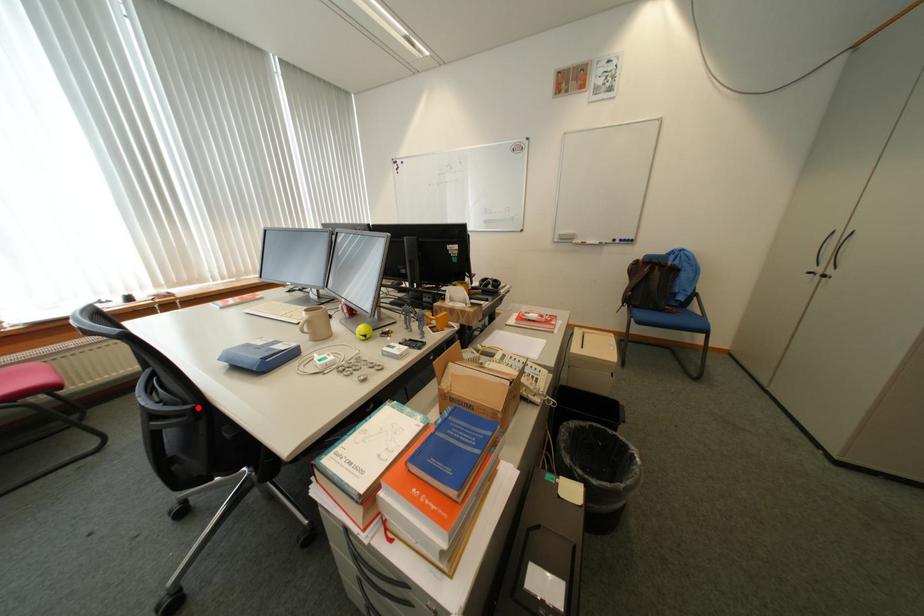
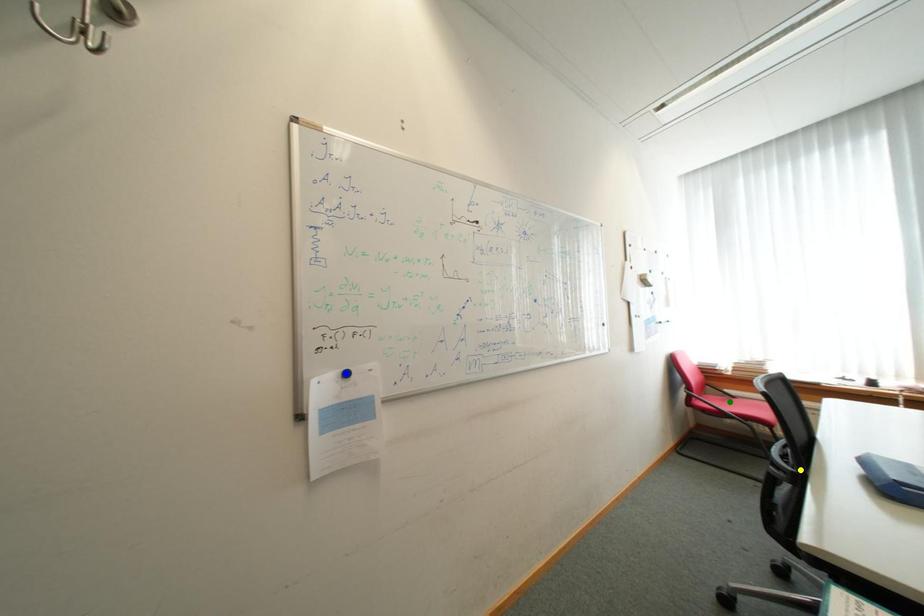
Question: I am providing you with two images of the same scene from different viewpoints. A red point is marked on the first image. You are given multiple points on the second image. Can you choose the point in image 2 that corresponds to the point in image 1?

Choices:
 (A) yellow point
 (B) blue point
 (C) green point

Answer: (A)